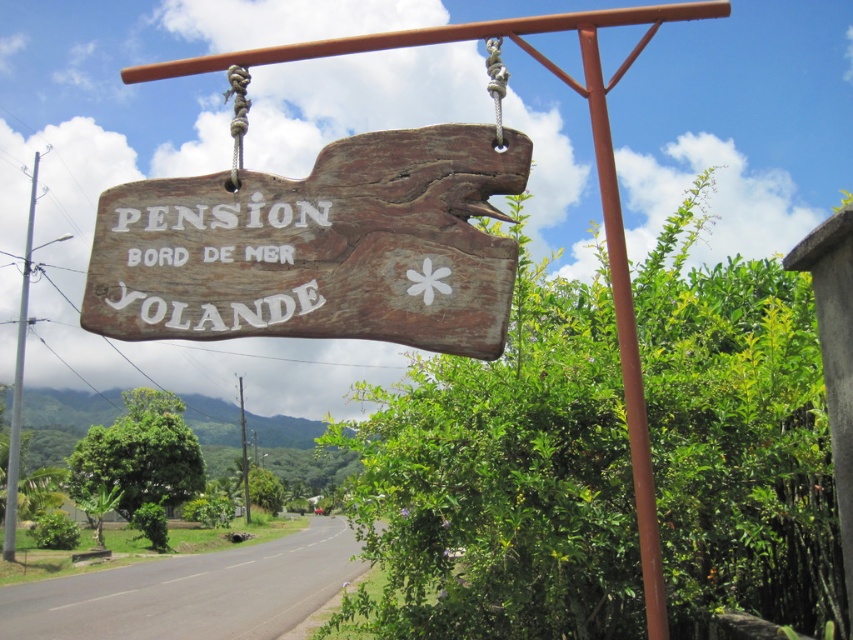
Question: Which object is closer to the camera taking this photo?

Choices:
 (A) silver metallic pole at left
 (B) brown wooden pole at center
 (C) weathered wood sign at center

Answer: (C)

Question: Can you confirm if weathered wood sign at center is positioned below brown wooden pole at center?

Choices:
 (A) no
 (B) yes

Answer: (A)

Question: Does silver metallic pole at left have a smaller size compared to brown wooden pole at center?

Choices:
 (A) yes
 (B) no

Answer: (B)

Question: Among these points, which one is nearest to the camera?

Choices:
 (A) (595, 154)
 (B) (479, 234)

Answer: (B)

Question: Among these points, which one is farthest from the camera?

Choices:
 (A) (648, 588)
 (B) (236, 250)
 (C) (244, 433)

Answer: (C)

Question: In this image, where is silver metallic pole at left located relative to brown wooden pole at center?

Choices:
 (A) right
 (B) left

Answer: (B)